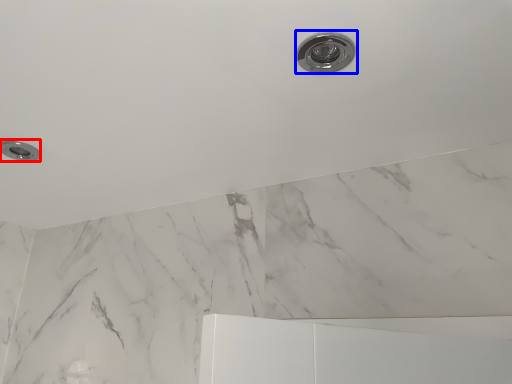
Question: Which object appears closest to the camera in this image, knob (highlighted by a red box) or plumbing fixture (highlighted by a blue box)?

Choices:
 (A) knob
 (B) plumbing fixture

Answer: (B)